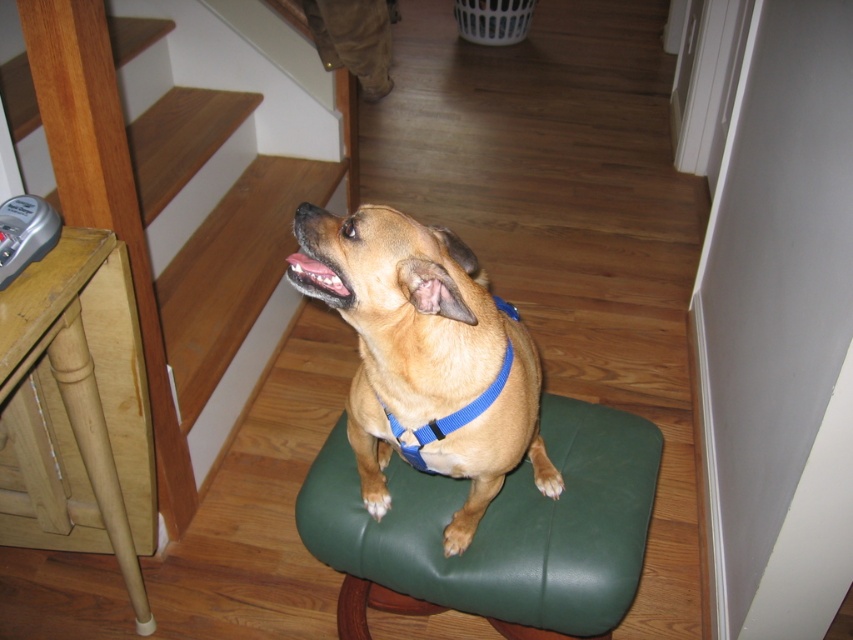
Can you confirm if wooden stair at left is smaller than blue fabric neckband at center?

Incorrect, wooden stair at left is not smaller in size than blue fabric neckband at center.

Which is behind, point (200, 148) or point (463, 413)?

The point (200, 148) is behind.

Describe the element at coordinates (184, 211) in the screenshot. I see `wooden stair at left` at that location.

Locate an element on the screen. The width and height of the screenshot is (853, 640). wooden stair at left is located at coordinates (184, 211).

Is point (247, 147) less distant than point (372, 301)?

That is False.

Locate an element on the screen. wooden stair at left is located at coordinates (184, 211).

Is point (550, 440) closer to camera compared to point (463, 292)?

No.

The image size is (853, 640). What do you see at coordinates (502, 524) in the screenshot?
I see `green leather stool at center` at bounding box center [502, 524].

Where is `green leather stool at center`? green leather stool at center is located at coordinates (502, 524).